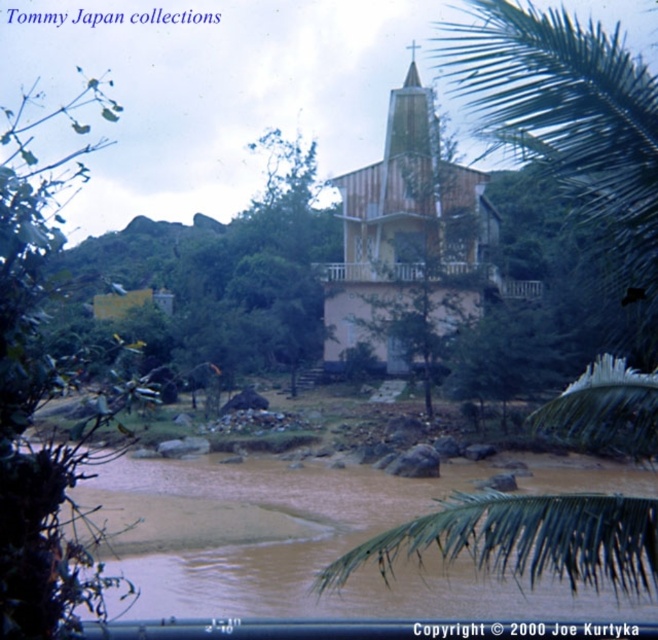
Question: Which object is the closest to the green leafy palm tree at upper right?

Choices:
 (A) green leafy tree at left
 (B) brown muddy water at lower center
 (C) wooden church at center

Answer: (B)

Question: Can you confirm if green leafy tree at left is wider than wooden church at center?

Choices:
 (A) no
 (B) yes

Answer: (B)

Question: Is green leafy palm tree at upper right above wooden church at center?

Choices:
 (A) no
 (B) yes

Answer: (B)

Question: Which point is farther from the camera taking this photo?

Choices:
 (A) (180, 588)
 (B) (93, 589)
 (C) (403, 88)

Answer: (C)

Question: Can you confirm if green leafy palm tree at upper right is wider than brown muddy water at lower center?

Choices:
 (A) yes
 (B) no

Answer: (B)

Question: Which point is farther to the camera?

Choices:
 (A) [561, 396]
 (B) [13, 256]
 (C) [255, 614]
 (D) [368, 264]

Answer: (D)